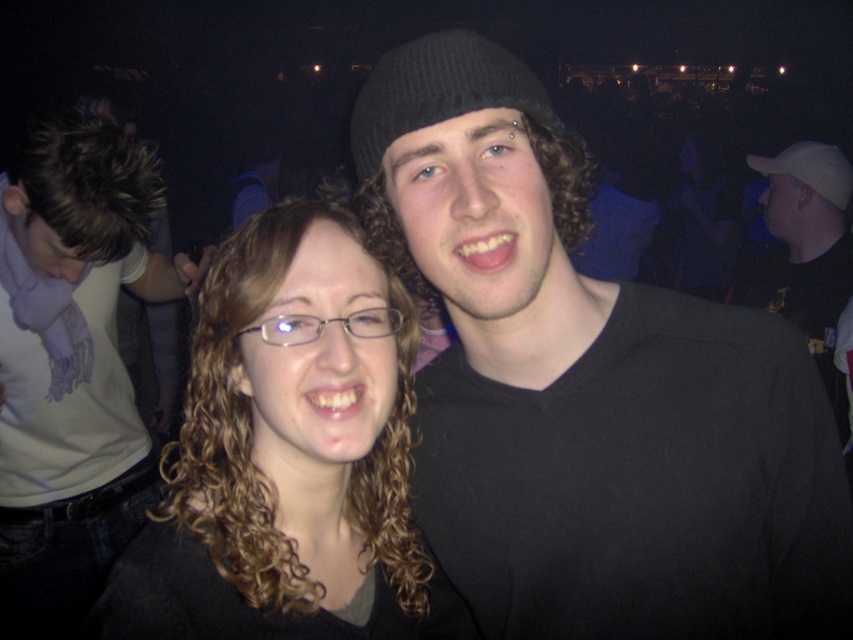
From the picture: Which of these two, curly hair at center or white t-shirt at left, stands shorter?

curly hair at center is shorter.

Does curly hair at center have a greater width compared to white t-shirt at left?

Incorrect, curly hair at center's width does not surpass white t-shirt at left's.

Where is `curly hair at center`? The height and width of the screenshot is (640, 853). curly hair at center is located at coordinates point(288,454).

Where is `curly hair at center`? This screenshot has height=640, width=853. curly hair at center is located at coordinates (288, 454).

Is white t-shirt at left bigger than black knit beanie at center?

Yes.

Identify the location of white t-shirt at left. This screenshot has width=853, height=640. tap(73, 365).

Who is more distant from viewer, (201, 262) or (412, 106)?

Positioned behind is point (201, 262).

In order to click on white t-shirt at left in this screenshot , I will do `click(73, 365)`.

Where is `black matte shirt at center`? This screenshot has height=640, width=853. black matte shirt at center is located at coordinates (589, 388).

Does black matte shirt at center have a lesser height compared to black knit beanie at center?

No.

Locate an element on the screen. This screenshot has width=853, height=640. black matte shirt at center is located at coordinates (589, 388).